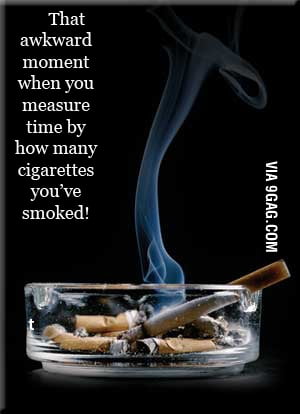
This screenshot has height=414, width=300. I want to click on table top, so click(79, 381).